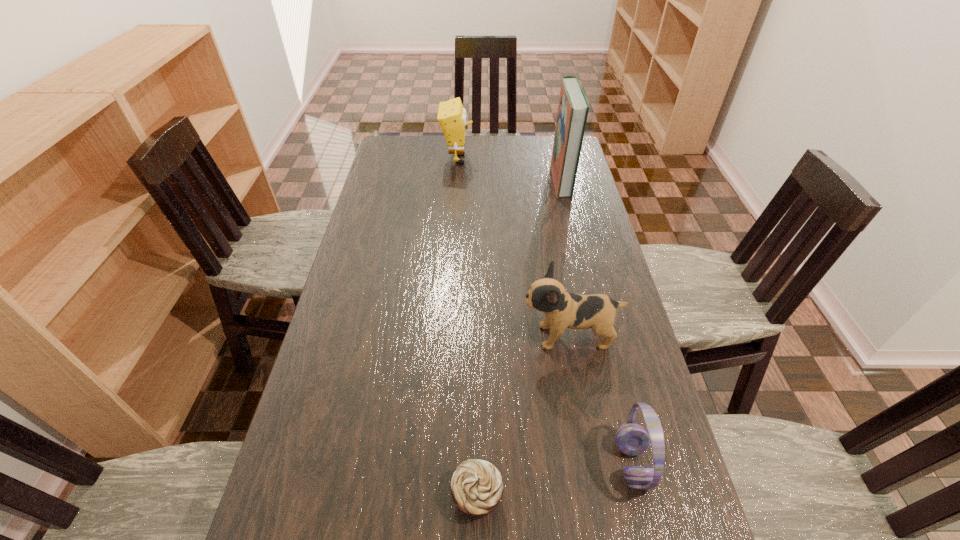
The image size is (960, 540). What are the coordinates of `headset situated at the right edge` in the screenshot? It's located at (632, 439).

The image size is (960, 540). I want to click on object positioned at the far right corner, so click(573, 107).

Find the location of a particular element. This screenshot has height=540, width=960. blank space at the far edge is located at coordinates (477, 164).

You are a GUI agent. You are given a task and a screenshot of the screen. Output one action in this format:
    pyautogui.click(x=<x>, y=<y>)
    Task: Click on the vacant space at the left edge of the desktop
    
    Given the screenshot: What is the action you would take?
    pyautogui.click(x=340, y=292)

The height and width of the screenshot is (540, 960). In order to click on free space at the right edge of the desktop in this screenshot , I will do `click(594, 392)`.

The image size is (960, 540). Identify the location of vacant space that's between the third nearest object and the second shortest object. (601, 400).

Locate an element on the screen. The image size is (960, 540). unoccupied position between the muffin and the sponge is located at coordinates (467, 327).

In order to click on free space between the hardback book and the sponge in this screenshot , I will do `click(509, 170)`.

You are a GUI agent. You are given a task and a screenshot of the screen. Output one action in this format:
    pyautogui.click(x=<x>, y=<y>)
    Task: Click on the free spot between the headset and the puppy
    Image resolution: width=960 pixels, height=540 pixels.
    Given the screenshot: What is the action you would take?
    pyautogui.click(x=601, y=400)

You are a GUI agent. You are given a task and a screenshot of the screen. Output one action in this format:
    pyautogui.click(x=<x>, y=<y>)
    Task: Click on the free point between the shortest object and the sponge
    This screenshot has width=960, height=540.
    Given the screenshot: What is the action you would take?
    point(467,327)